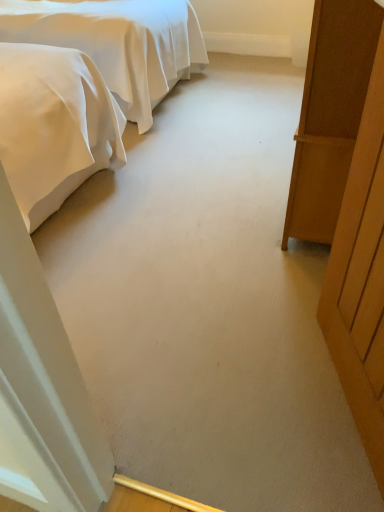
Question: Is wooden door at right wider than wooden wardrobe at right?

Choices:
 (A) no
 (B) yes

Answer: (A)

Question: Is wooden door at right smaller than wooden wardrobe at right?

Choices:
 (A) yes
 (B) no

Answer: (A)

Question: Is wooden door at right at the right side of wooden wardrobe at right?

Choices:
 (A) no
 (B) yes

Answer: (A)

Question: Could you tell me if wooden door at right is turned towards wooden wardrobe at right?

Choices:
 (A) yes
 (B) no

Answer: (B)

Question: Does wooden door at right come in front of wooden wardrobe at right?

Choices:
 (A) no
 (B) yes

Answer: (B)

Question: Can you confirm if wooden door at right is thinner than wooden wardrobe at right?

Choices:
 (A) no
 (B) yes

Answer: (B)

Question: Does satin white bed at upper left have a larger size compared to wooden door at right?

Choices:
 (A) yes
 (B) no

Answer: (A)

Question: Does satin white bed at upper left have a smaller size compared to wooden door at right?

Choices:
 (A) yes
 (B) no

Answer: (B)

Question: Is satin white bed at upper left to the left of wooden door at right from the viewer's perspective?

Choices:
 (A) yes
 (B) no

Answer: (A)

Question: Would you say satin white bed at upper left is outside wooden door at right?

Choices:
 (A) no
 (B) yes

Answer: (B)

Question: Is satin white bed at upper left further to the viewer compared to wooden door at right?

Choices:
 (A) no
 (B) yes

Answer: (B)

Question: From a real-world perspective, is satin white bed at upper left physically below wooden door at right?

Choices:
 (A) no
 (B) yes

Answer: (B)

Question: From the image's perspective, does wooden door at right appear higher than satin white bed at upper left?

Choices:
 (A) yes
 (B) no

Answer: (B)